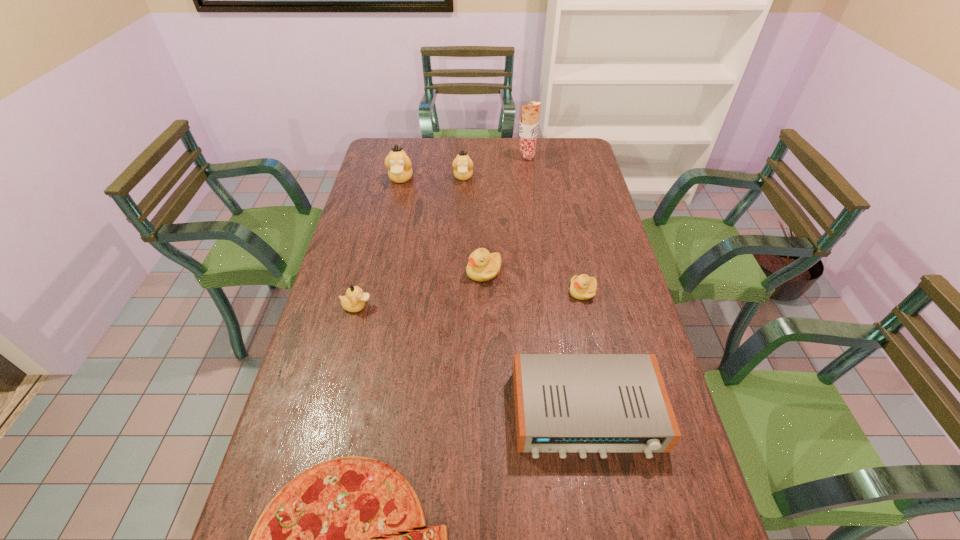
The height and width of the screenshot is (540, 960). In order to click on the rightmost duckling in this screenshot , I will do `click(583, 287)`.

At what (x,y) coordinates should I click in order to perform the action: click on vacant space located on the right of the tallest object. Please return your answer as a coordinate pair (x, y). This screenshot has width=960, height=540. Looking at the image, I should click on (568, 157).

At what (x,y) coordinates should I click in order to perform the action: click on vacant space located on the face of the second tallest object. Please return your answer as a coordinate pair (x, y). The width and height of the screenshot is (960, 540). Looking at the image, I should click on (384, 254).

The width and height of the screenshot is (960, 540). In order to click on free region located on the face of the rightmost tan duckling in this screenshot , I will do pos(462,202).

Locate an element on the screen. The image size is (960, 540). free region located on the beak of the bigger yellow duckling is located at coordinates (388, 271).

You are a GUI agent. You are given a task and a screenshot of the screen. Output one action in this format:
    pyautogui.click(x=<x>, y=<y>)
    Task: Click on the vacant space located on the beak of the bigger yellow duckling
    The image size is (960, 540).
    Given the screenshot: What is the action you would take?
    pyautogui.click(x=364, y=271)

Locate an element on the screen. vacant area located 0.360m on the beak of the bigger yellow duckling is located at coordinates (354, 271).

Find the location of a particular element. vacant point located on the face of the smallest tan duckling is located at coordinates (503, 306).

This screenshot has height=540, width=960. What are the coordinates of `free space located 0.080m on the control panel of the radio receiver` in the screenshot? It's located at (602, 498).

Locate an element on the screen. The image size is (960, 540). free location located 0.170m on the beak of the smaller yellow duckling is located at coordinates (514, 292).